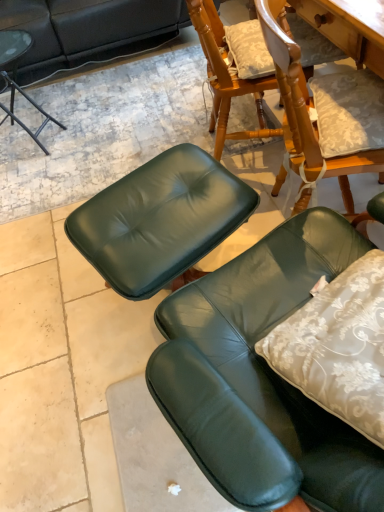
I want to click on free spot in front of matte black side table at upper left, the 1th chair when ordered from left to right, so click(x=43, y=176).